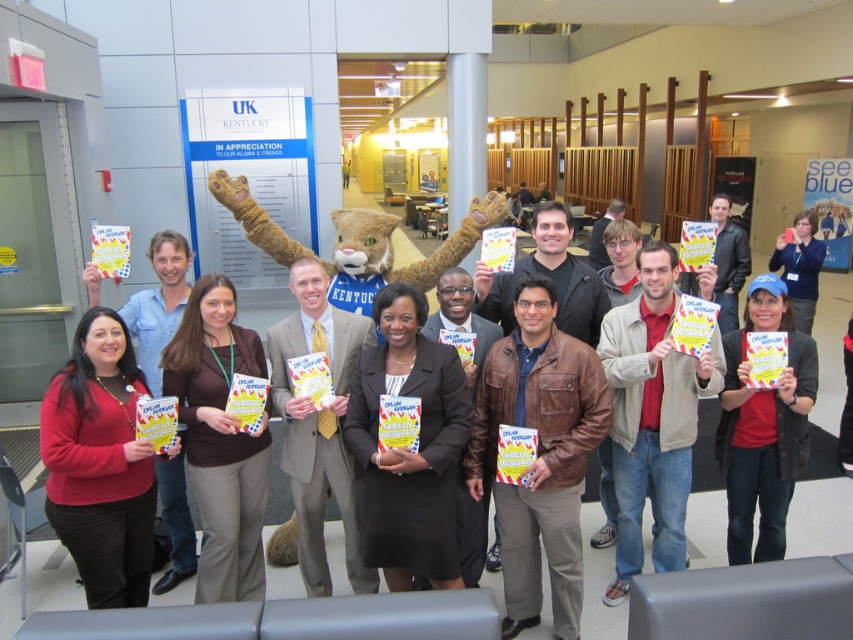
Is point (276, 252) closer to camera compared to point (790, 284)?

Yes, point (276, 252) is closer to viewer.

Does furry plush at center lie in front of matte blue cap at center?

Yes.

Identify the location of furry plush at center. Image resolution: width=853 pixels, height=640 pixels. (357, 243).

Who is lower down, furry plush at center or matte red sweater at lower left?

matte red sweater at lower left

Where is `furry plush at center`? The height and width of the screenshot is (640, 853). furry plush at center is located at coordinates (357, 243).

Can you confirm if matte red sweater at lower left is smaller than matte blue cap at center?

Yes, matte red sweater at lower left is smaller than matte blue cap at center.

Between matte red sweater at lower left and matte blue cap at center, which one has more height?

matte blue cap at center

Is point (166, 301) closer to camera compared to point (804, 324)?

That is True.

This screenshot has width=853, height=640. I want to click on matte red sweater at lower left, so click(x=158, y=304).